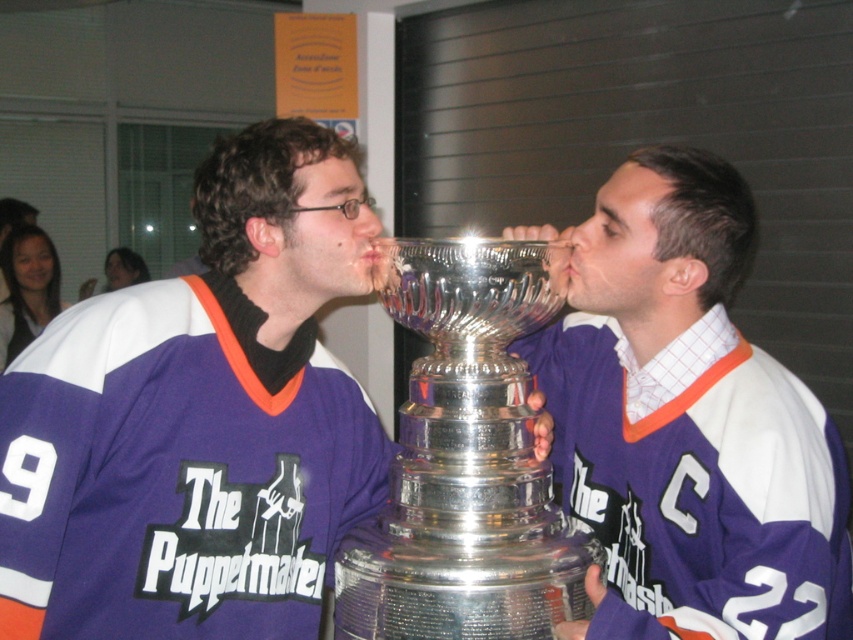
Based on the coordinates provided, which object corresponds to the point at (198, 420)?

The point at (198, 420) corresponds to the matte purple jersey at center.

You are a photographer at a hockey award ceremony. You need to capture a photo of the silver polished trophy at center and the matte plastic nose at center. Which object should you focus on first if you want to ensure both are in focus without adjusting the camera settings?

The silver polished trophy at center is larger in size than the matte plastic nose at center, so focusing on the larger object first would help maintain focus on both without needing to adjust the camera settings.

You are a photographer at a hockey awards ceremony. You need to position your camera to capture both the silver polished trophy at center and the two hockey players. Given the trophy is at coordinates point 0.717, 0.546, where should you place your camera to ensure both the trophy and the players are in frame?

The silver polished trophy at center is positioned at point (x=465, y=458). To capture both the trophy and the players in frame, the camera should be placed centrally to ensure the trophy at the center coordinates remains the focal point while the players are framed around it.